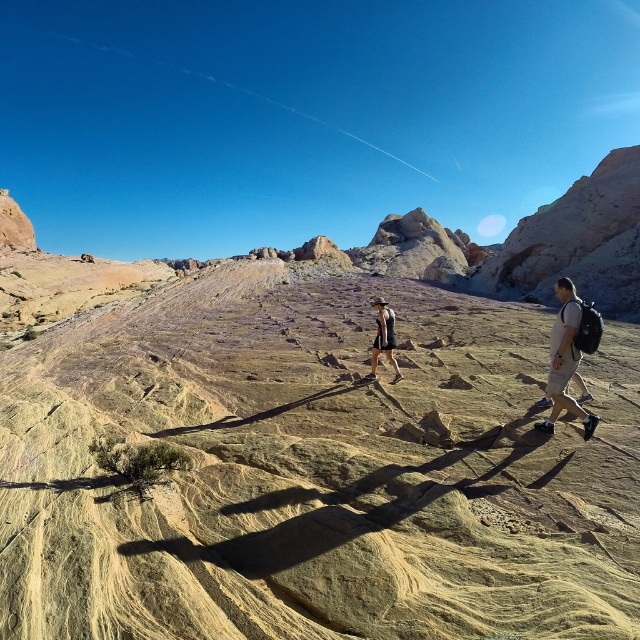
Can you confirm if light brown canvas backpack at right is shorter than matte black shorts at center?

Indeed, light brown canvas backpack at right has a lesser height compared to matte black shorts at center.

Which is more to the left, light brown canvas backpack at right or matte black shorts at center?

matte black shorts at center is more to the left.

Where is `light brown canvas backpack at right`? light brown canvas backpack at right is located at coordinates (570, 353).

Find the location of a particular element. The image size is (640, 640). light brown canvas backpack at right is located at coordinates (570, 353).